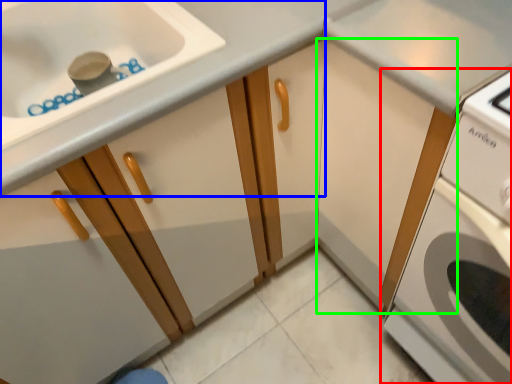
Question: Estimate the real-world distances between objects in this image. Which object is farther from home appliance (highlighted by a red box), cabinetry (highlighted by a blue box) or cabinetry (highlighted by a green box)?

Choices:
 (A) cabinetry
 (B) cabinetry

Answer: (A)